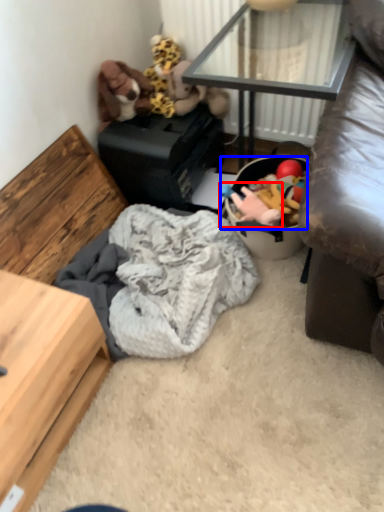
Question: Which object appears closest to the camera in this image, toy (highlighted by a red box) or stuff (highlighted by a blue box)?

Choices:
 (A) toy
 (B) stuff

Answer: (B)